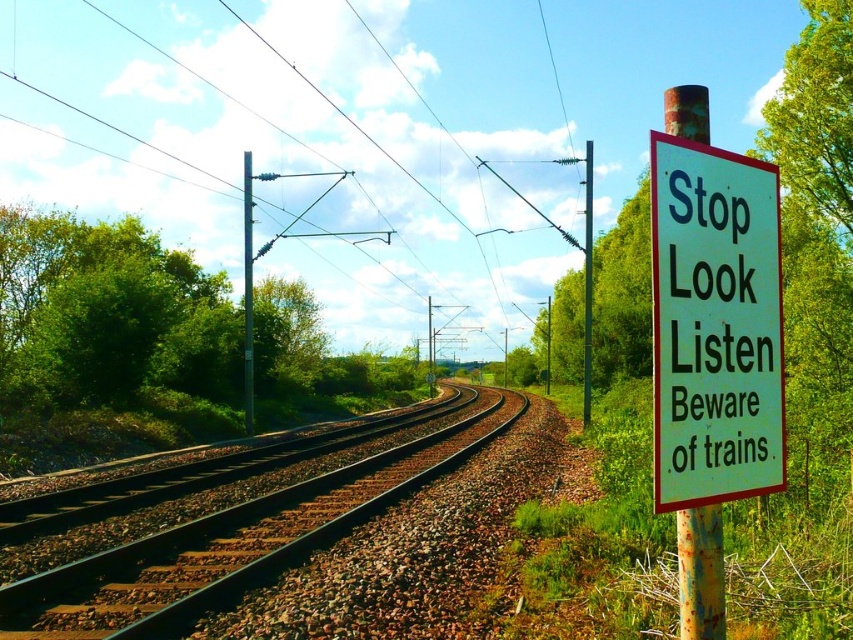
Question: Does white paper sign at right appear over white plastic sign at center?

Choices:
 (A) yes
 (B) no

Answer: (A)

Question: Which object appears farthest from the camera in this image?

Choices:
 (A) rusty metal pole at right
 (B) rusty metal signpost at right

Answer: (A)

Question: Is metallic wires at upper center further to the viewer compared to white paper sign at right?

Choices:
 (A) yes
 (B) no

Answer: (A)

Question: Which object is farther from the camera taking this photo?

Choices:
 (A) metallic pole at center
 (B) metallic wires at upper center
 (C) brown gravel tracks at center

Answer: (B)

Question: Which object appears closest to the camera in this image?

Choices:
 (A) rusty metal pole at right
 (B) brown gravel tracks at center
 (C) rusty metal signpost at right
 (D) white plastic sign at center

Answer: (C)

Question: Does white paper sign at right appear on the right side of white plastic sign at center?

Choices:
 (A) yes
 (B) no

Answer: (A)